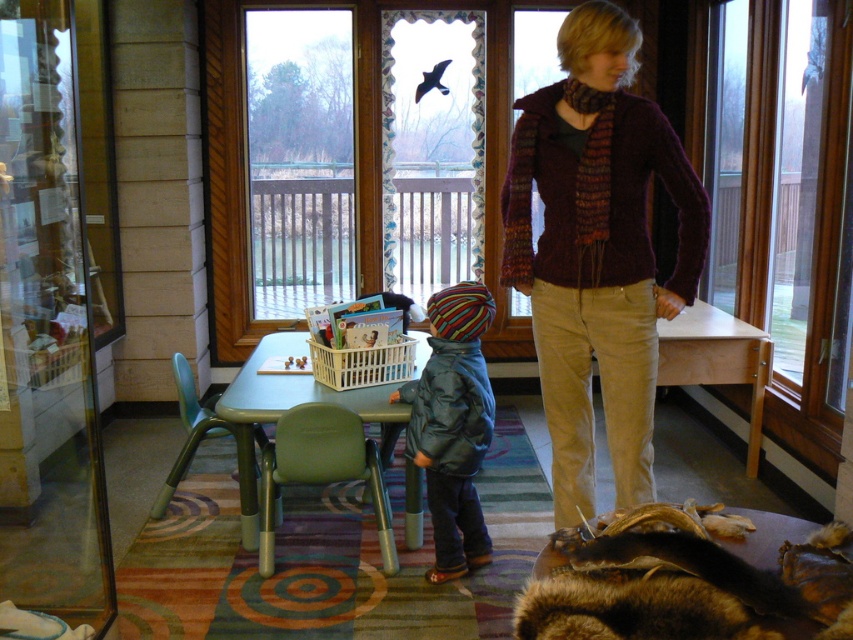
Question: Can you confirm if blue waterproof jacket at center is smaller than green plastic chair at lower center?

Choices:
 (A) yes
 (B) no

Answer: (B)

Question: Which object is the farthest from the blue waterproof jacket at center?

Choices:
 (A) transparent glass screen door at left
 (B) maroon knitted sweater at center
 (C) green plastic chair at lower left

Answer: (A)

Question: Is green plastic chair at lower center to the left of white plastic laundry basket at center from the viewer's perspective?

Choices:
 (A) yes
 (B) no

Answer: (A)

Question: Among these points, which one is nearest to the camera?

Choices:
 (A) (303, 410)
 (B) (206, 416)

Answer: (A)

Question: Is transparent glass screen door at left bigger than blue waterproof jacket at center?

Choices:
 (A) yes
 (B) no

Answer: (A)

Question: Considering the real-world distances, which object is closest to the maroon knitted sweater at center?

Choices:
 (A) blue waterproof jacket at center
 (B) transparent glass screen door at left

Answer: (A)